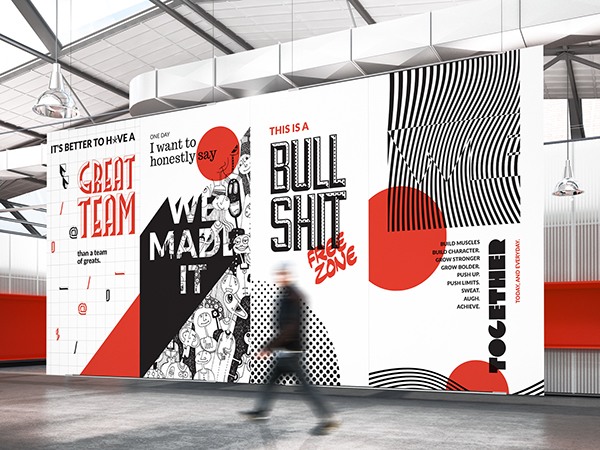
The width and height of the screenshot is (600, 450). I want to click on large posters, so click(x=443, y=248), click(x=306, y=225), click(x=184, y=237), click(x=70, y=261).